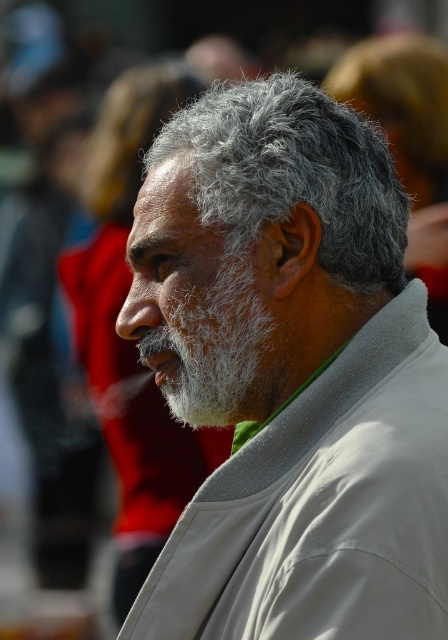
Is gray hair at center wider than white fuzzy beard at center?

Yes.

Is gray hair at center to the right of white fuzzy beard at center from the viewer's perspective?

Correct, you'll find gray hair at center to the right of white fuzzy beard at center.

Who is more distant from viewer, (268, 308) or (241, 388)?

Positioned behind is point (241, 388).

This screenshot has width=448, height=640. Identify the location of gray hair at center. (289, 372).

Who is positioned more to the right, white fuzzy beard at center or gray fuzzy hair at center?

white fuzzy beard at center

In the scene shown: Between white fuzzy beard at center and gray fuzzy hair at center, which one is positioned lower?

Positioned lower is white fuzzy beard at center.

The height and width of the screenshot is (640, 448). Find the location of `white fuzzy beard at center`. white fuzzy beard at center is located at coordinates (211, 342).

This screenshot has height=640, width=448. I want to click on white fuzzy beard at center, so click(x=211, y=342).

Which of these two, gray hair at center or gray fuzzy hair at center, stands shorter?

Standing shorter between the two is gray fuzzy hair at center.

Is gray hair at center to the right of gray fuzzy hair at center from the viewer's perspective?

Correct, you'll find gray hair at center to the right of gray fuzzy hair at center.

Based on the photo, who is more distant from viewer, (442,362) or (151,70)?

The point (151,70) is more distant.

Find the location of a particular element. The height and width of the screenshot is (640, 448). gray hair at center is located at coordinates (289, 372).